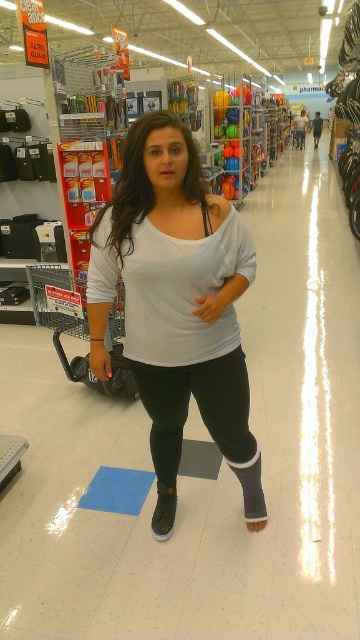
Between white matte shirt at center and black matte leggings at center, which one appears on the right side from the viewer's perspective?

black matte leggings at center

Is point (213, 220) positioned after point (230, 406)?

No, (213, 220) is in front of (230, 406).

Is point (219, 253) behind point (240, 476)?

No, (219, 253) is in front of (240, 476).

Locate an element on the screen. white matte shirt at center is located at coordinates (177, 305).